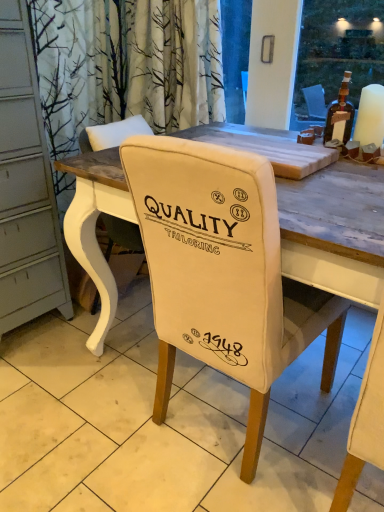
Question: Is brown glass bottle at upper right thinner than white fabric chair back at center?

Choices:
 (A) yes
 (B) no

Answer: (A)

Question: From the image's perspective, is brown glass bottle at upper right located above white fabric chair back at center?

Choices:
 (A) no
 (B) yes

Answer: (B)

Question: Is brown glass bottle at upper right shorter than white fabric chair back at center?

Choices:
 (A) yes
 (B) no

Answer: (B)

Question: Is the depth of brown glass bottle at upper right greater than that of white fabric chair back at center?

Choices:
 (A) yes
 (B) no

Answer: (A)

Question: Is brown glass bottle at upper right looking in the opposite direction of white fabric chair back at center?

Choices:
 (A) no
 (B) yes

Answer: (A)

Question: Looking at their shapes, would you say white fabric chair at center is wider or thinner than brown glass bottle at upper right?

Choices:
 (A) wide
 (B) thin

Answer: (A)

Question: Considering the positions of white fabric chair at center and brown glass bottle at upper right in the image, is white fabric chair at center taller or shorter than brown glass bottle at upper right?

Choices:
 (A) short
 (B) tall

Answer: (B)

Question: From a real-world perspective, relative to brown glass bottle at upper right, is white fabric chair at center vertically above or below?

Choices:
 (A) above
 (B) below

Answer: (B)

Question: Based on their positions, is white fabric chair at center located to the left or right of brown glass bottle at upper right?

Choices:
 (A) right
 (B) left

Answer: (B)

Question: In terms of size, does brown glass bottle at upper right appear bigger or smaller than white fabric chair back at center?

Choices:
 (A) small
 (B) big

Answer: (A)

Question: From a real-world perspective, is brown glass bottle at upper right physically located above or below white fabric chair back at center?

Choices:
 (A) above
 (B) below

Answer: (A)

Question: From their relative heights in the image, would you say brown glass bottle at upper right is taller or shorter than white fabric chair back at center?

Choices:
 (A) short
 (B) tall

Answer: (B)

Question: From the image's perspective, is brown glass bottle at upper right located above or below white fabric chair back at center?

Choices:
 (A) above
 (B) below

Answer: (A)

Question: Relative to white fabric chair at center, is brown glass bottle at upper right in front or behind?

Choices:
 (A) front
 (B) behind

Answer: (B)

Question: Is point (332, 104) closer or farther from the camera than point (185, 215)?

Choices:
 (A) farther
 (B) closer

Answer: (A)